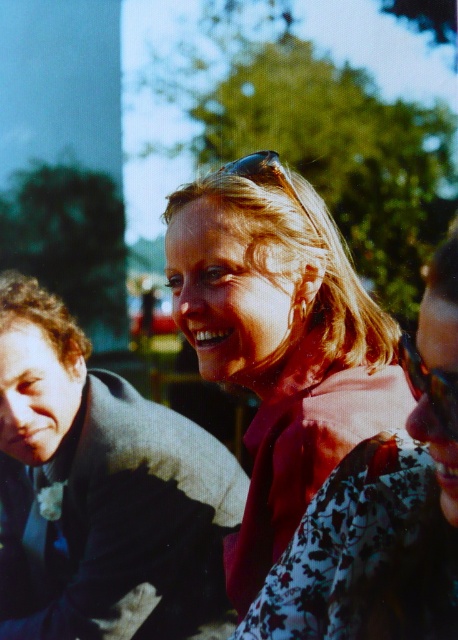
Who is more distant from viewer, (x=167, y=608) or (x=250, y=545)?

Point (x=167, y=608)

Does dark gray suit at left come behind pink fabric at center?

Yes, it is.

This screenshot has height=640, width=458. What are the coordinates of `dark gray suit at left` in the screenshot? It's located at (101, 492).

Is pink fabric at center above clear plastic sunglasses at center?

No.

Can you confirm if pink fabric at center is positioned to the left of clear plastic sunglasses at center?

No, pink fabric at center is not to the left of clear plastic sunglasses at center.

Describe the element at coordinates (279, 340) in the screenshot. I see `pink fabric at center` at that location.

Where is `pink fabric at center`? pink fabric at center is located at coordinates (x=279, y=340).

Is dark gray suit at left above translucent plastic goggles at lower right?

Incorrect, dark gray suit at left is not positioned above translucent plastic goggles at lower right.

Measure the distance between dark gray suit at left and camera.

6.57 feet

From the picture: Who is more distant from viewer, (63, 624) or (448, 385)?

The point (63, 624) is more distant.

Find the location of a particular element. Image resolution: width=458 pixels, height=640 pixels. dark gray suit at left is located at coordinates (101, 492).